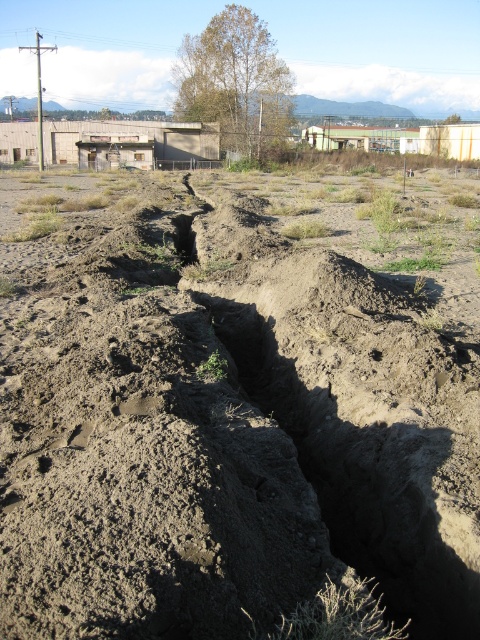
How far apart are dull brown dirt at center and dark brown dirt at center?

dull brown dirt at center is 3.32 meters away from dark brown dirt at center.

Consider the image. Does dull brown dirt at center have a smaller size compared to dark brown dirt at center?

Incorrect, dull brown dirt at center is not smaller in size than dark brown dirt at center.

Who is more forward, (442,602) or (173,236)?

Point (442,602)

Locate an element on the screen. dull brown dirt at center is located at coordinates (220, 422).